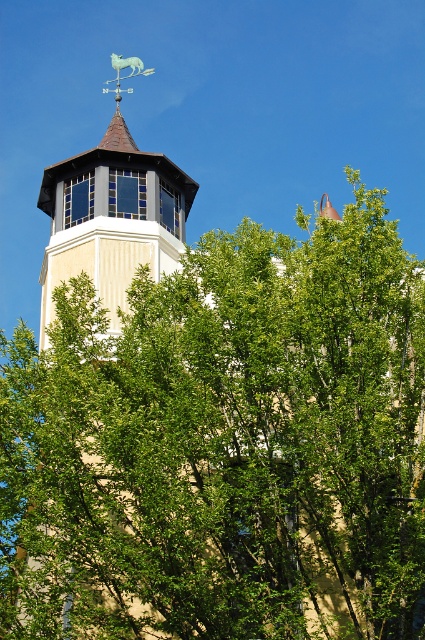
Question: Among these points, which one is nearest to the camera?

Choices:
 (A) (170, 211)
 (B) (248, 380)
 (C) (147, 70)

Answer: (B)

Question: Can you confirm if green copper weather vane at upper center is bigger than metallic blue horse at upper center?

Choices:
 (A) yes
 (B) no

Answer: (A)

Question: Which is farther from the green leafy tree at center?

Choices:
 (A) metallic blue horse at upper center
 (B) green copper weather vane at upper center

Answer: (A)

Question: In this image, where is green leafy tree at center located relative to green copper weather vane at upper center?

Choices:
 (A) above
 (B) below

Answer: (B)

Question: Which point is closer to the camera?

Choices:
 (A) (84, 216)
 (B) (56, 515)

Answer: (B)

Question: Is green leafy tree at center to the left of metallic blue horse at upper center from the viewer's perspective?

Choices:
 (A) yes
 (B) no

Answer: (B)